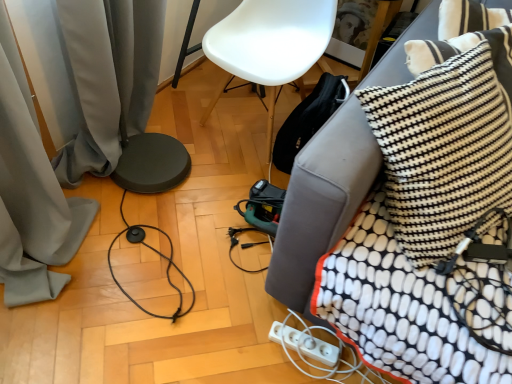
Locate an element on the screen. This screenshot has height=384, width=512. vacant region to the left of white plastic power strip at lower right is located at coordinates (249, 339).